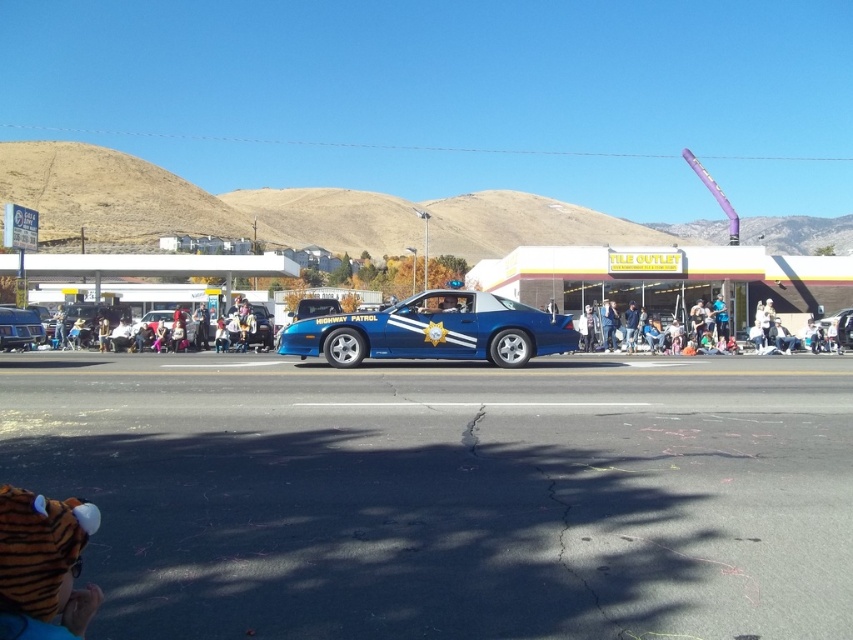
Question: From the image, what is the correct spatial relationship of shiny blue car at center in relation to glossy blue car at left?

Choices:
 (A) above
 (B) below

Answer: (A)

Question: Can you confirm if glossy blue car at left is positioned to the right of blue glossy jacket at center?

Choices:
 (A) yes
 (B) no

Answer: (B)

Question: Based on their relative distances, which object is nearer to the blue glossy uniform at center?

Choices:
 (A) tiger costume at lower left
 (B) glossy blue car at left
 (C) blue glossy jacket at center

Answer: (C)

Question: Is glossy blue car at left to the left of blue glossy jacket at center from the viewer's perspective?

Choices:
 (A) yes
 (B) no

Answer: (A)

Question: Which object appears closest to the camera in this image?

Choices:
 (A) tiger costume at lower left
 (B) blue glossy jacket at center
 (C) shiny blue car at center

Answer: (A)

Question: Considering the real-world distances, which object is farthest from the tiger costume at lower left?

Choices:
 (A) shiny blue car at center
 (B) glossy blue car at left

Answer: (B)